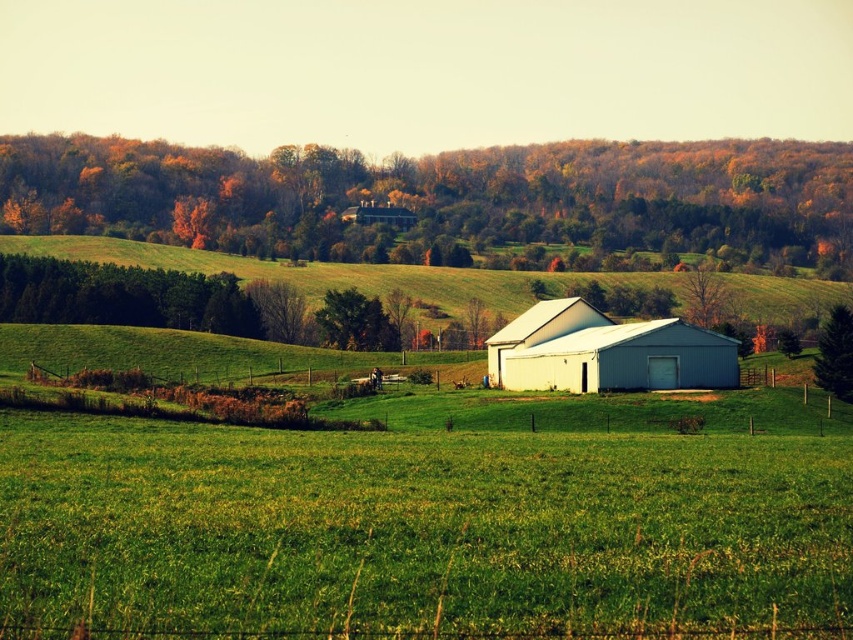
You are a farmer planning to plant a row of trees along the edge of the green grassy hillside at center and the white matte barn at upper center. Which area has more space available for planting the trees?

The green grassy hillside at center might be wider than the white matte barn at upper center, so it likely has more space available for planting the trees.

You are standing in the field and want to walk towards the white matte barn at upper center. Which direction should you head relative to the green grassy hillside at center?

The green grassy hillside at center is to the right of the white matte barn at upper center, so you should head to the left of the green grassy hillside at center to reach the white matte barn at upper center.